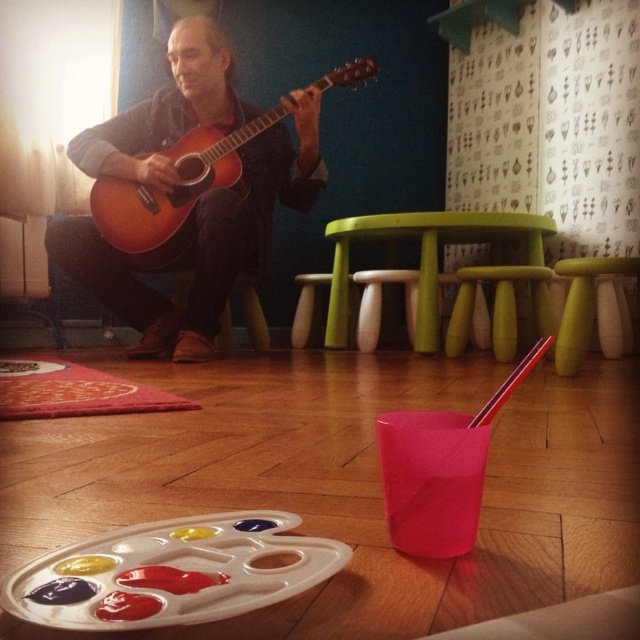
Who is more forward, (272,140) or (161,262)?

Point (161,262)

Find the location of `matte brown guitar at center`. matte brown guitar at center is located at coordinates (202, 241).

Does matte brown guitar at center have a larger size compared to yellow matte stool at center?

Yes, matte brown guitar at center is bigger than yellow matte stool at center.

Which is below, matte brown guitar at center or yellow matte stool at center?

Positioned lower is yellow matte stool at center.

The image size is (640, 640). In order to click on matte brown guitar at center in this screenshot , I will do `click(202, 241)`.

Find the location of a particular element. matte brown guitar at center is located at coordinates (202, 241).

Does matte brown acoustic guitar at center have a smaller size compared to green plastic stool at center?

Indeed, matte brown acoustic guitar at center has a smaller size compared to green plastic stool at center.

Which is more to the left, matte brown acoustic guitar at center or green plastic stool at center?

From the viewer's perspective, matte brown acoustic guitar at center appears more on the left side.

Where is `matte brown acoustic guitar at center`? The height and width of the screenshot is (640, 640). matte brown acoustic guitar at center is located at coordinates (173, 192).